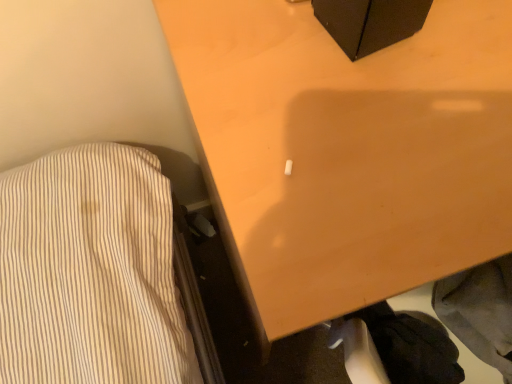
Question: From a real-world perspective, is black fabric at lower right located higher than wooden table at center?

Choices:
 (A) yes
 (B) no

Answer: (A)

Question: From a real-world perspective, is black fabric at lower right under wooden table at center?

Choices:
 (A) yes
 (B) no

Answer: (B)

Question: Is black fabric at lower right at the left side of wooden table at center?

Choices:
 (A) yes
 (B) no

Answer: (A)

Question: From the image's perspective, is black fabric at lower right below wooden table at center?

Choices:
 (A) yes
 (B) no

Answer: (A)

Question: Is black fabric at lower right further to camera compared to wooden table at center?

Choices:
 (A) yes
 (B) no

Answer: (A)

Question: Is black fabric at lower right not inside wooden table at center?

Choices:
 (A) yes
 (B) no

Answer: (A)

Question: Can you confirm if wooden table at center is smaller than black fabric at lower right?

Choices:
 (A) yes
 (B) no

Answer: (B)

Question: Would you consider wooden table at center to be distant from black fabric at lower right?

Choices:
 (A) no
 (B) yes

Answer: (A)

Question: Is black fabric at lower right completely or partially inside wooden table at center?

Choices:
 (A) yes
 (B) no

Answer: (B)

Question: Is wooden table at center turned away from black fabric at lower right?

Choices:
 (A) no
 (B) yes

Answer: (A)

Question: From a real-world perspective, is wooden table at center on top of black fabric at lower right?

Choices:
 (A) yes
 (B) no

Answer: (B)

Question: Is wooden table at center behind black fabric at lower right?

Choices:
 (A) yes
 (B) no

Answer: (B)

Question: In terms of width, does wooden table at center look wider or thinner when compared to black fabric at lower right?

Choices:
 (A) wide
 (B) thin

Answer: (A)